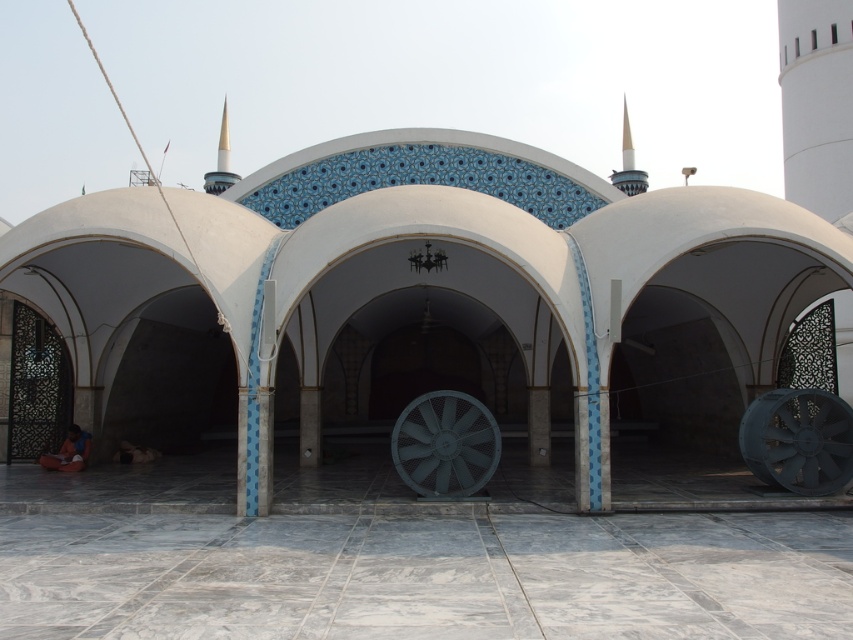
Question: Does metallic gray fan at lower right appear on the left side of gray metallic fan at center?

Choices:
 (A) no
 (B) yes

Answer: (A)

Question: Which object appears closest to the camera in this image?

Choices:
 (A) metallic gray fan at lower right
 (B) gray metallic fan at center

Answer: (B)

Question: Can you confirm if metallic gray fan at lower right is wider than gray metallic fan at center?

Choices:
 (A) no
 (B) yes

Answer: (A)

Question: Among these points, which one is farthest from the camera?

Choices:
 (A) (793, 435)
 (B) (436, 433)

Answer: (A)

Question: Can you confirm if metallic gray fan at lower right is wider than gray metallic fan at center?

Choices:
 (A) no
 (B) yes

Answer: (A)

Question: Which point is farther from the camera taking this photo?

Choices:
 (A) (752, 472)
 (B) (428, 484)

Answer: (A)